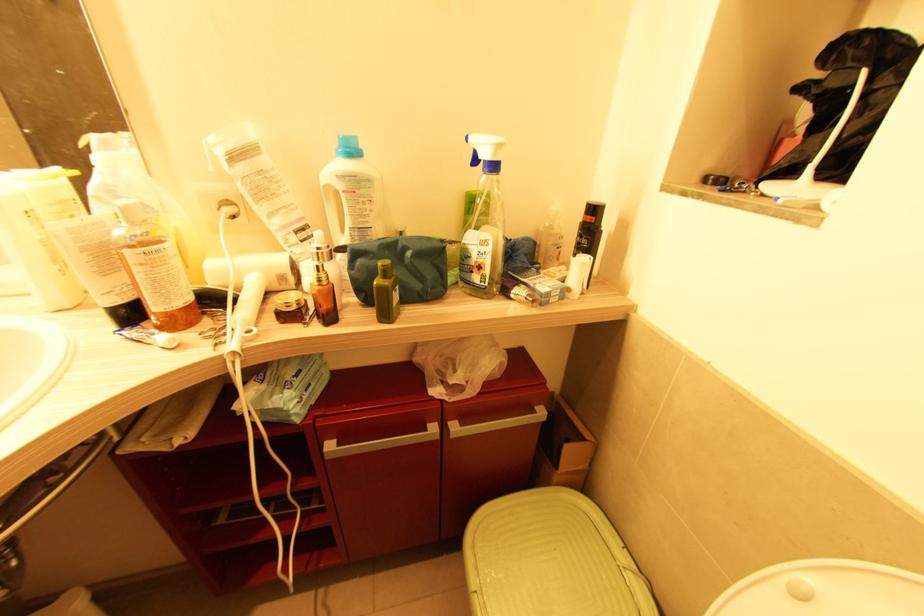
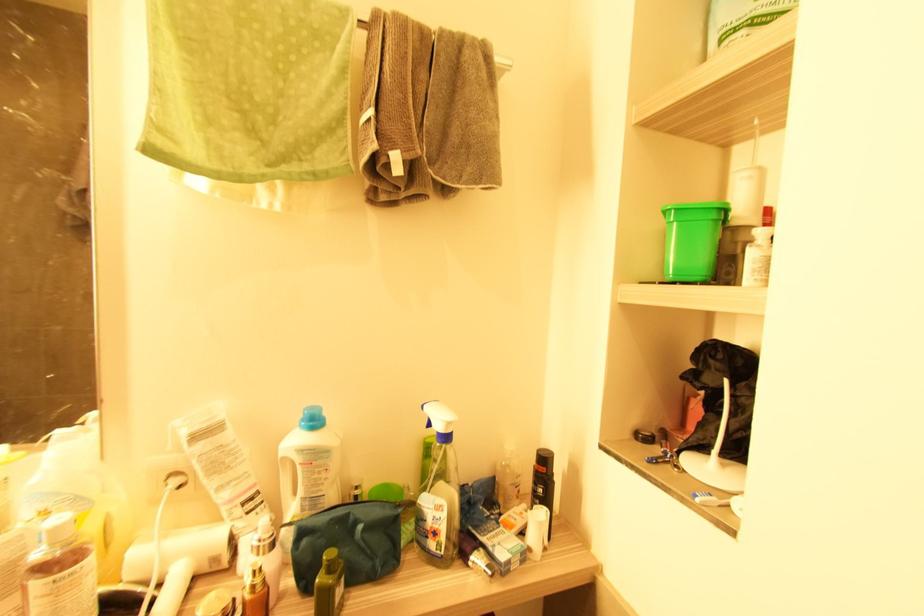
In the second image, find the point that corresponds to (284,278) in the first image.

(216, 561)